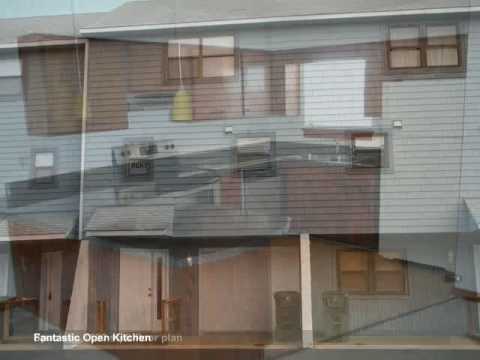
Where is `text that reads fantastic open kitchen plan`? This screenshot has height=360, width=480. text that reads fantastic open kitchen plan is located at coordinates (52, 339), (98, 335), (140, 338).